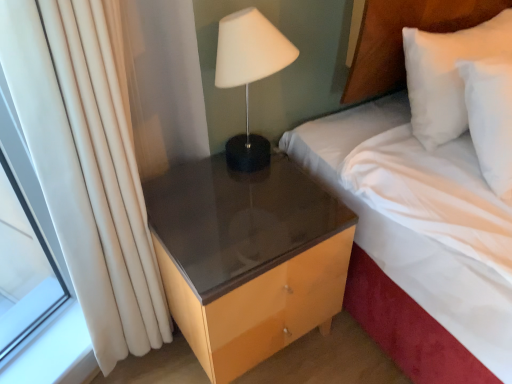
Question: Is glossy wood nightstand at lower right wider than white fabric bed at upper right?

Choices:
 (A) yes
 (B) no

Answer: (B)

Question: Is glossy wood nightstand at lower right facing towards white fabric bed at upper right?

Choices:
 (A) no
 (B) yes

Answer: (A)

Question: Is glossy wood nightstand at lower right at the right side of white fabric bed at upper right?

Choices:
 (A) yes
 (B) no

Answer: (B)

Question: Considering the relative sizes of glossy wood nightstand at lower right and white fabric bed at upper right in the image provided, is glossy wood nightstand at lower right bigger than white fabric bed at upper right?

Choices:
 (A) no
 (B) yes

Answer: (A)

Question: Is white fabric bed at upper right completely or partially inside glossy wood nightstand at lower right?

Choices:
 (A) yes
 (B) no

Answer: (B)

Question: Can you confirm if glossy wood nightstand at lower right is positioned to the left of white fabric bed at upper right?

Choices:
 (A) yes
 (B) no

Answer: (A)

Question: From the image's perspective, is white fabric bed at upper right beneath white matte lamp at upper right?

Choices:
 (A) yes
 (B) no

Answer: (A)

Question: From the image's perspective, is white fabric bed at upper right located above white matte lamp at upper right?

Choices:
 (A) no
 (B) yes

Answer: (A)

Question: Considering the relative sizes of white fabric bed at upper right and white matte lamp at upper right in the image provided, is white fabric bed at upper right thinner than white matte lamp at upper right?

Choices:
 (A) no
 (B) yes

Answer: (A)

Question: Is white matte lamp at upper right surrounded by white fabric bed at upper right?

Choices:
 (A) yes
 (B) no

Answer: (B)

Question: Is white fabric bed at upper right shorter than white matte lamp at upper right?

Choices:
 (A) yes
 (B) no

Answer: (B)

Question: Is white fabric bed at upper right turned away from white matte lamp at upper right?

Choices:
 (A) no
 (B) yes

Answer: (A)

Question: Can you confirm if white matte lamp at upper right is positioned to the left of glossy wood nightstand at lower right?

Choices:
 (A) yes
 (B) no

Answer: (B)